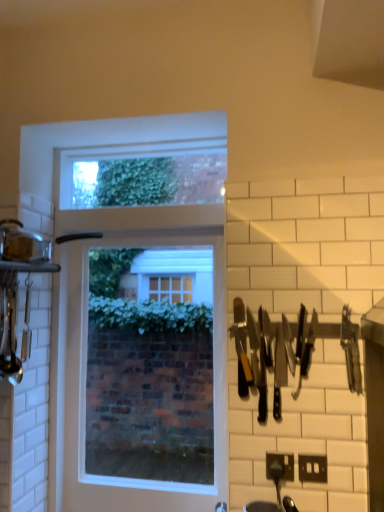
Question: Visually, is black plastic knives at right positioned to the left or to the right of black plastic electric outlet at lower right?

Choices:
 (A) right
 (B) left

Answer: (B)

Question: Considering the positions of black plastic knives at right and black plastic electric outlet at lower right in the image, is black plastic knives at right taller or shorter than black plastic electric outlet at lower right?

Choices:
 (A) short
 (B) tall

Answer: (B)

Question: Based on their relative distances, which object is nearer to the black plastic electric outlet at lower right?

Choices:
 (A) black plastic knives at right
 (B) clear glass window at center

Answer: (A)

Question: Based on their relative distances, which object is nearer to the clear glass window at center?

Choices:
 (A) black plastic electric outlet at lower right
 (B) black plastic knives at right

Answer: (B)